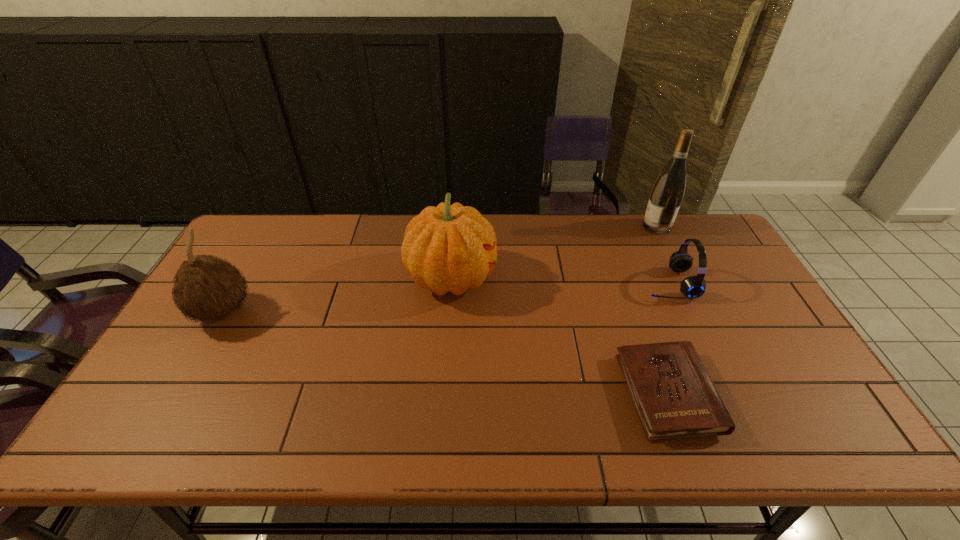
Locate an element on the screen. This screenshot has width=960, height=540. blank region between the headset and the wine bottle is located at coordinates (662, 255).

The height and width of the screenshot is (540, 960). Find the location of `unoccupied position between the nearest object and the wine bottle`. unoccupied position between the nearest object and the wine bottle is located at coordinates (661, 310).

Where is `empty space that is in between the wine bottle and the pumpkin`? empty space that is in between the wine bottle and the pumpkin is located at coordinates (554, 252).

At what (x,y) coordinates should I click in order to perform the action: click on free area in between the fourth object from right to left and the nearest object. Please return your answer as a coordinate pair (x, y). The height and width of the screenshot is (540, 960). Looking at the image, I should click on (559, 336).

Find the location of `empty space between the wine bottle and the nearest object`. empty space between the wine bottle and the nearest object is located at coordinates (661, 310).

Identify the location of object that stands as the closest to the hardback book. The height and width of the screenshot is (540, 960). (692, 287).

Find the location of a particular element. This screenshot has width=960, height=540. object that is the closest to the headset is located at coordinates (667, 194).

Find the location of a particular element. vacant space that satisfies the following two spatial constraints: 1. on the carved face of the nearest object; 2. on the right side of the pumpkin is located at coordinates (444, 394).

Identify the location of vacant space that satisfies the following two spatial constraints: 1. on the carved face of the fourth object from right to left; 2. on the left side of the hardback book. The width and height of the screenshot is (960, 540). (444, 394).

What are the coordinates of `free spot that satisfies the following two spatial constraints: 1. on the carved face of the second object from left to right; 2. on the left side of the nearest object` in the screenshot? It's located at (444, 394).